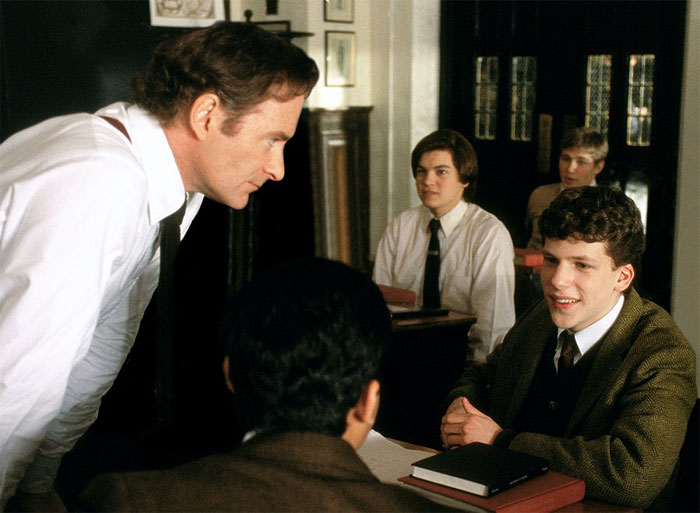
Where is `stack of books on desk`? stack of books on desk is located at coordinates (512, 510).